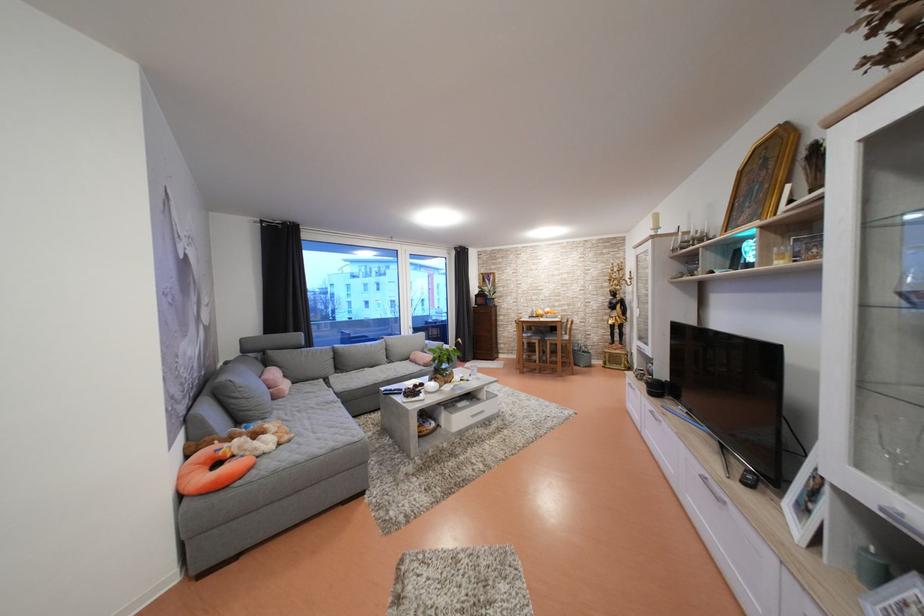
What do you see at coordinates (310, 410) in the screenshot? I see `the sofa sitting surface` at bounding box center [310, 410].